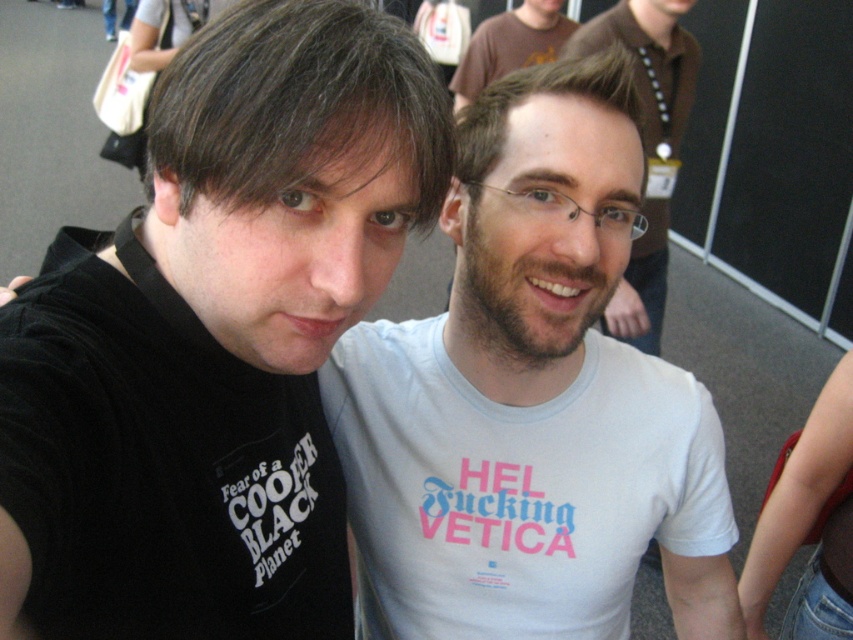
Between smooth white t-shirt at center and matte brown t-shirt at upper center, which one is positioned higher?

Positioned higher is matte brown t-shirt at upper center.

Between point (689, 84) and point (560, 42), which one is positioned in front?

Point (689, 84) is more forward.

Locate an element on the screen. smooth white t-shirt at center is located at coordinates (648, 61).

Can you confirm if black matte t-shirt at left is positioned above smooth white t-shirt at center?

Actually, black matte t-shirt at left is below smooth white t-shirt at center.

The image size is (853, 640). Identify the location of black matte t-shirt at left. (219, 333).

What do you see at coordinates (219, 333) in the screenshot? This screenshot has height=640, width=853. I see `black matte t-shirt at left` at bounding box center [219, 333].

At what (x,y) coordinates should I click in order to perform the action: click on black matte t-shirt at left. Please return your answer as a coordinate pair (x, y). The image size is (853, 640). Looking at the image, I should click on (219, 333).

Who is more distant from viewer, (132, 259) or (502, 572)?

Positioned behind is point (502, 572).

Between black matte t-shirt at left and white cotton t-shirt at center, which one appears on the right side from the viewer's perspective?

From the viewer's perspective, white cotton t-shirt at center appears more on the right side.

The width and height of the screenshot is (853, 640). I want to click on black matte t-shirt at left, so click(x=219, y=333).

Locate an element on the screen. black matte t-shirt at left is located at coordinates (219, 333).